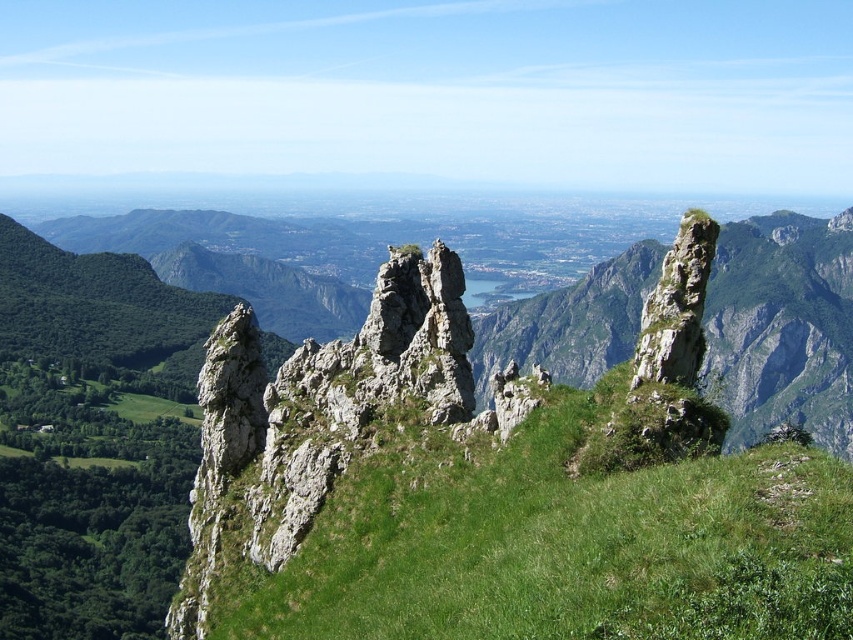
You are a hiker planning to cross the valley. You see the green grassy at center and the rough stone rock at right. Which of these two features is higher in elevation?

The green grassy at center is taller than the rough stone rock at right, so it has a higher elevation.

You are planning to set up a campsite in the mountainous landscape. You have a tent that requires a minimum of 10 square meters of flat space. Based on the scene, which location between the green grassy at center and the rough stone rock at right would be more suitable for setting up your tent?

The green grassy at center is more suitable for setting up the tent because its width is larger than the rough stone rock at right, providing a wider and potentially flatter area to accommodate the tent.